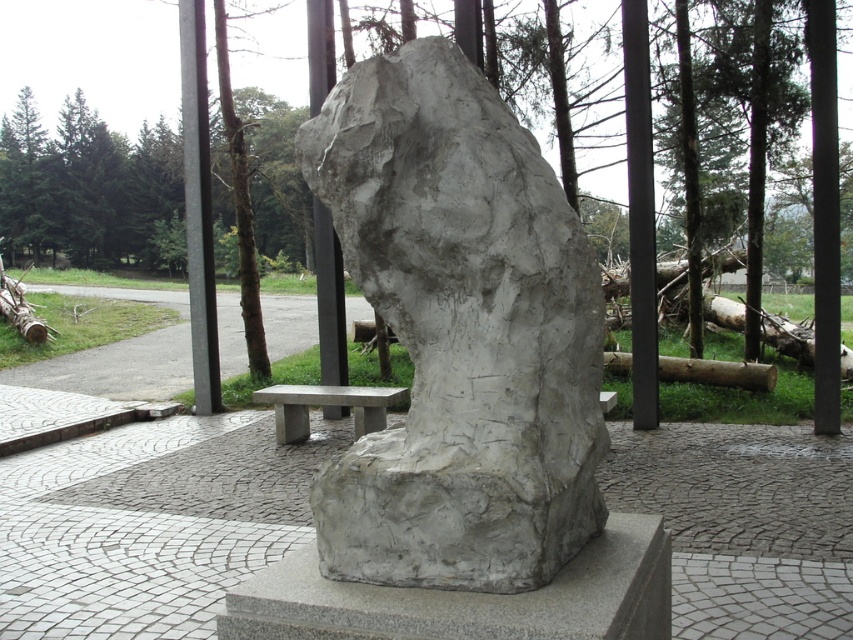
Question: Which is farther from the smooth concrete bench at center?

Choices:
 (A) white stone sculpture at center
 (B) gray granite cement at center

Answer: (A)

Question: Which point is farther from the camera taking this photo?

Choices:
 (A) (495, 572)
 (B) (606, 582)
 (C) (322, 394)

Answer: (C)

Question: Considering the relative positions of white stone sculpture at center and smooth concrete bench at center in the image provided, where is white stone sculpture at center located with respect to smooth concrete bench at center?

Choices:
 (A) below
 (B) above

Answer: (B)

Question: Which of the following is the closest to the observer?

Choices:
 (A) (440, 600)
 (B) (587, 449)

Answer: (A)

Question: Is white stone sculpture at center to the right of gray granite cement at center from the viewer's perspective?

Choices:
 (A) yes
 (B) no

Answer: (B)

Question: Can you confirm if white stone sculpture at center is thinner than smooth concrete bench at center?

Choices:
 (A) yes
 (B) no

Answer: (A)